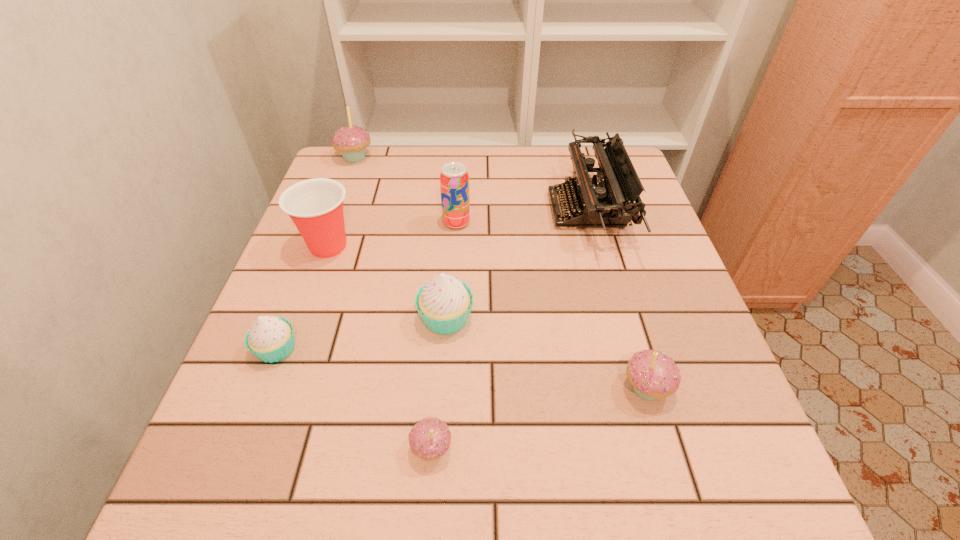
Find the location of a particular element. object that stands as the sixth closest to the second biggest pink cupcake is located at coordinates (315, 206).

Point out which object is positioned as the fourth nearest to the soda can. Please provide its 2D coordinates. Your answer should be formatted as a tuple, i.e. [(x, y)], where the tuple contains the x and y coordinates of a point satisfying the conditions above.

[(351, 141)]

Locate which cupcake is the third closest to the right white cupcake. Please provide its 2D coordinates. Your answer should be formatted as a tuple, i.e. [(x, y)], where the tuple contains the x and y coordinates of a point satisfying the conditions above.

[(652, 374)]

Find the location of a particular element. This screenshot has height=540, width=960. cupcake that is the third closest one to the typewriter is located at coordinates (430, 438).

Where is `the second closest pink cupcake to the typewriter`? This screenshot has height=540, width=960. the second closest pink cupcake to the typewriter is located at coordinates (430, 438).

Locate an element on the screen. Image resolution: width=960 pixels, height=540 pixels. pink cupcake that is the second closest to the tallest cupcake is located at coordinates (652, 374).

At what (x,y) coordinates should I click in order to perform the action: click on vacant space that satisfies the following two spatial constraints: 1. on the front side of the cup; 2. on the left side of the bigger white cupcake. Please return your answer as a coordinate pair (x, y). The width and height of the screenshot is (960, 540). Looking at the image, I should click on 303,318.

The image size is (960, 540). In order to click on free location that satisfies the following two spatial constraints: 1. on the back side of the nearest pink cupcake; 2. on the right side of the bigger white cupcake in this screenshot , I will do `click(442, 318)`.

Where is `vacant space that satisfies the following two spatial constraints: 1. on the front side of the second pink cupcake from left to right; 2. on the right side of the farthest pink cupcake`? This screenshot has width=960, height=540. vacant space that satisfies the following two spatial constraints: 1. on the front side of the second pink cupcake from left to right; 2. on the right side of the farthest pink cupcake is located at coordinates (248, 448).

Identify the location of vacant area in the image that satisfies the following two spatial constraints: 1. on the typing side of the typewriter; 2. on the front side of the red cup. 596,246.